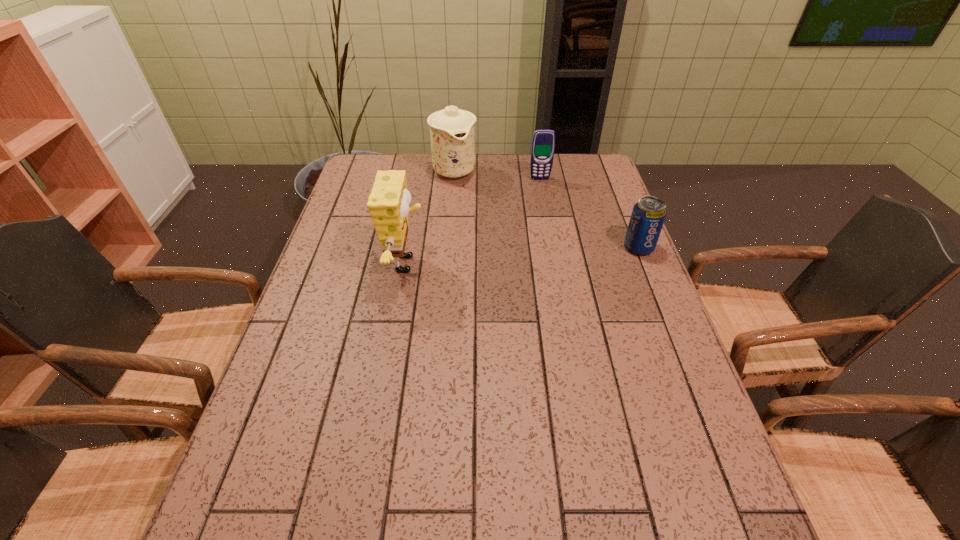
This screenshot has height=540, width=960. I want to click on free area in between the rightmost object and the sponge, so click(523, 256).

Identify the location of empty location between the sponge and the third object from left to right. This screenshot has width=960, height=540. (473, 221).

Identify which object is the third closest to the sponge. Please provide its 2D coordinates. Your answer should be formatted as a tuple, i.e. [(x, y)], where the tuple contains the x and y coordinates of a point satisfying the conditions above.

[(648, 215)]

Choose which object is the third nearest neighbor to the chinaware. Please provide its 2D coordinates. Your answer should be formatted as a tuple, i.e. [(x, y)], where the tuple contains the x and y coordinates of a point satisfying the conditions above.

[(648, 215)]